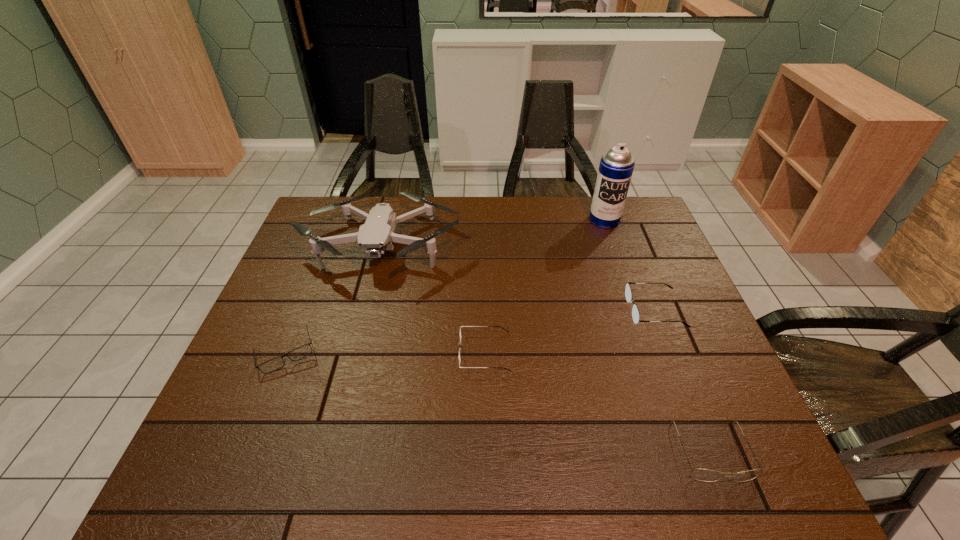
At what (x,y) coordinates should I click in order to perform the action: click on the second closest object to the aerosol can. Please return your answer as a coordinate pair (x, y). Looking at the image, I should click on pos(375,236).

Find the location of a particular element. Image resolution: width=960 pixels, height=540 pixels. object that is the fourth closest one to the drone is located at coordinates pos(628,293).

Identify which spectacles is located as the second nearest to the aerosol can. Please provide its 2D coordinates. Your answer should be formatted as a tuple, i.e. [(x, y)], where the tuple contains the x and y coordinates of a point satisfying the conditions above.

[(460, 326)]

Identify which spectacles is the third closest to the leftmost spectacles. Please provide its 2D coordinates. Your answer should be formatted as a tuple, i.e. [(x, y)], where the tuple contains the x and y coordinates of a point satisfying the conditions above.

[(705, 475)]

Identify the location of vacant space that satisfies the following two spatial constraints: 1. on the label side of the aerosol can; 2. on the front-facing side of the second spectacles from left to right. (651, 353).